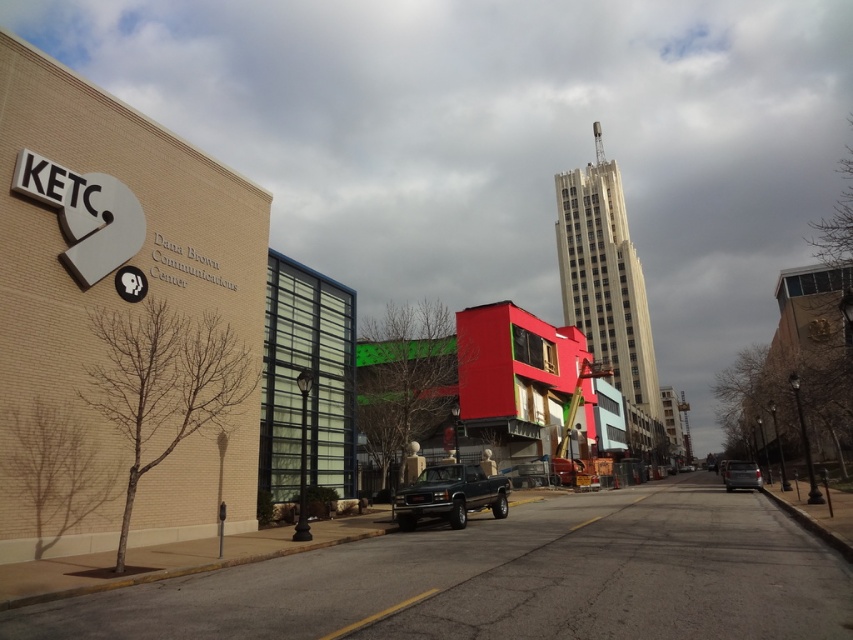
Who is more forward, (497, 492) or (751, 461)?

Point (497, 492)

Is the position of matte black truck at center more distant than that of metallic gray van at center?

That is False.

Between point (473, 477) and point (747, 464), which one is positioned in front?

Point (473, 477) is in front.

I want to click on matte black truck at center, so click(450, 496).